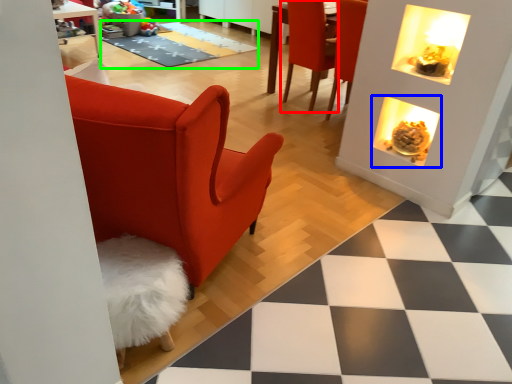
Question: Which object is the farthest from chair (highlighted by a red box)? Choose among these: fireplace (highlighted by a blue box) or mat (highlighted by a green box).

Choices:
 (A) fireplace
 (B) mat

Answer: (B)